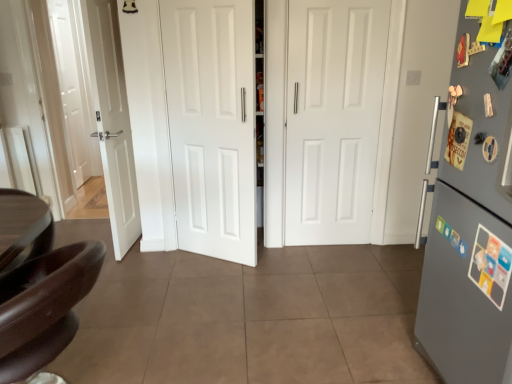
Question: Is point (308, 13) closer or farther from the camera than point (31, 306)?

Choices:
 (A) closer
 (B) farther

Answer: (B)

Question: In terms of size, does white matte door at center, positioned as the first door in right-to-left order, appear bigger or smaller than shiny brown leather chair at lower left?

Choices:
 (A) big
 (B) small

Answer: (B)

Question: Based on their relative distances, which object is nearer to the white matte door at center, the second door viewed from the left?

Choices:
 (A) shiny brown leather chair at lower left
 (B) gray matte refrigerator at right
 (C) white matte door at center, which is counted as the 1th door, starting from the left

Answer: (C)

Question: Estimate the real-world distances between objects in this image. Which object is closer to the white matte door at center, which is counted as the 1th door, starting from the left?

Choices:
 (A) gray matte refrigerator at right
 (B) shiny brown leather chair at lower left
 (C) white matte door at center, positioned as the first door in right-to-left order

Answer: (C)